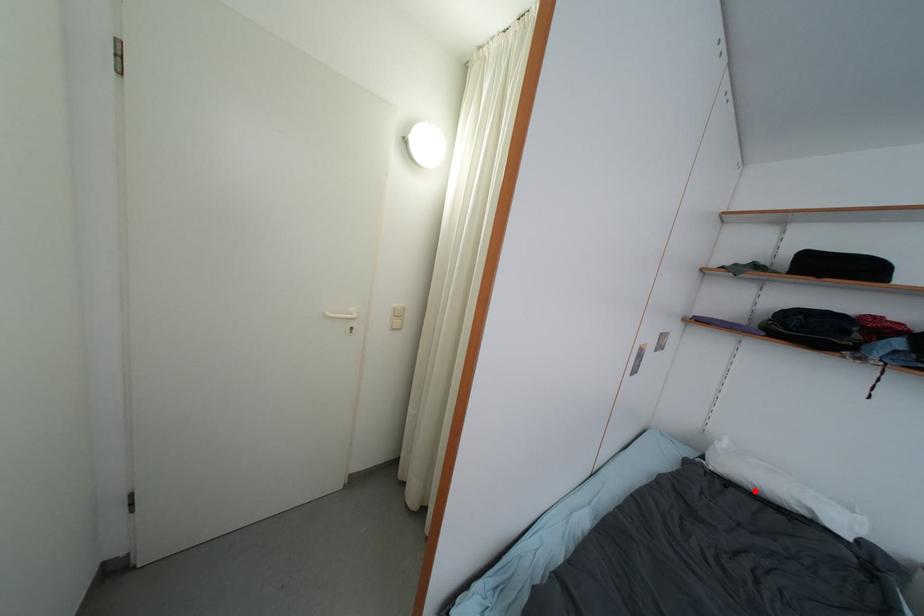
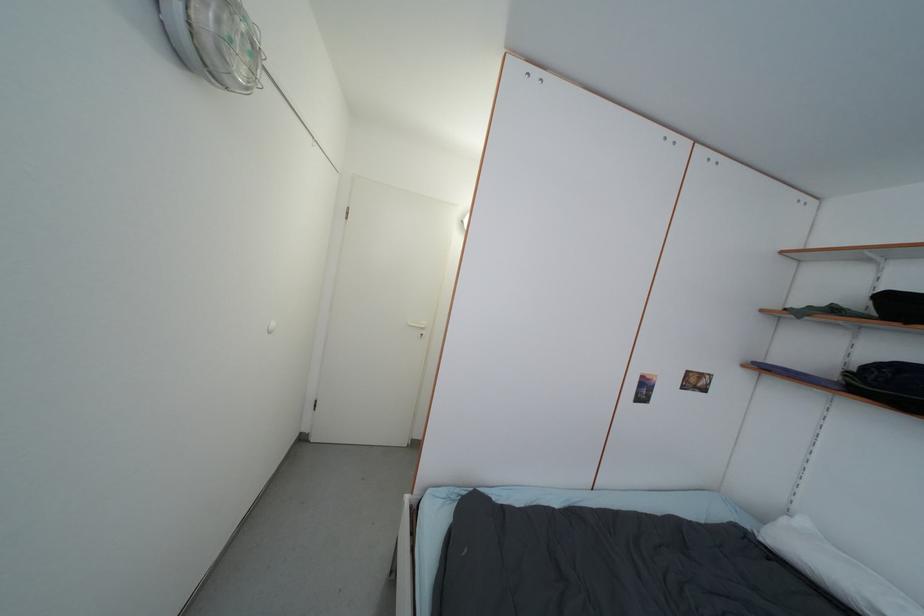
Locate, in the second image, the point that corresponds to the highlighted location in the first image.

(812, 576)